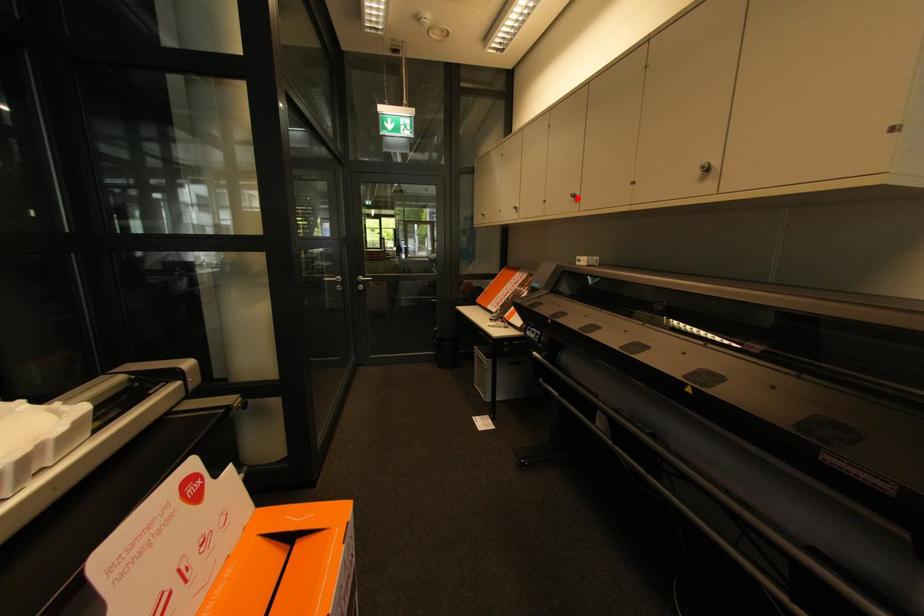
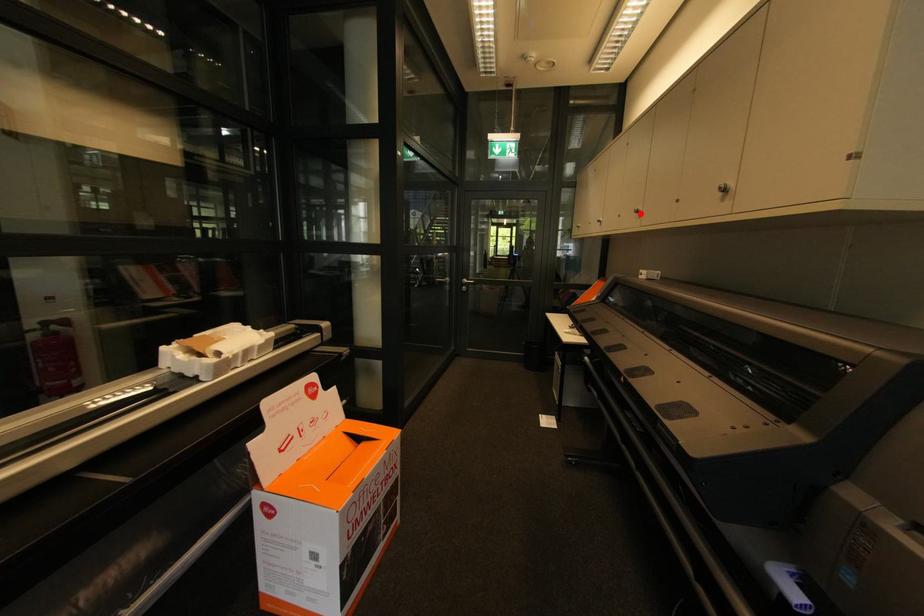
From the picture: I am providing you with two images of the same scene from different viewpoints. A red point is marked on the first image and another point is marked on the second image. Is the red point in image1 aligned with the point shown in image2?

Yes